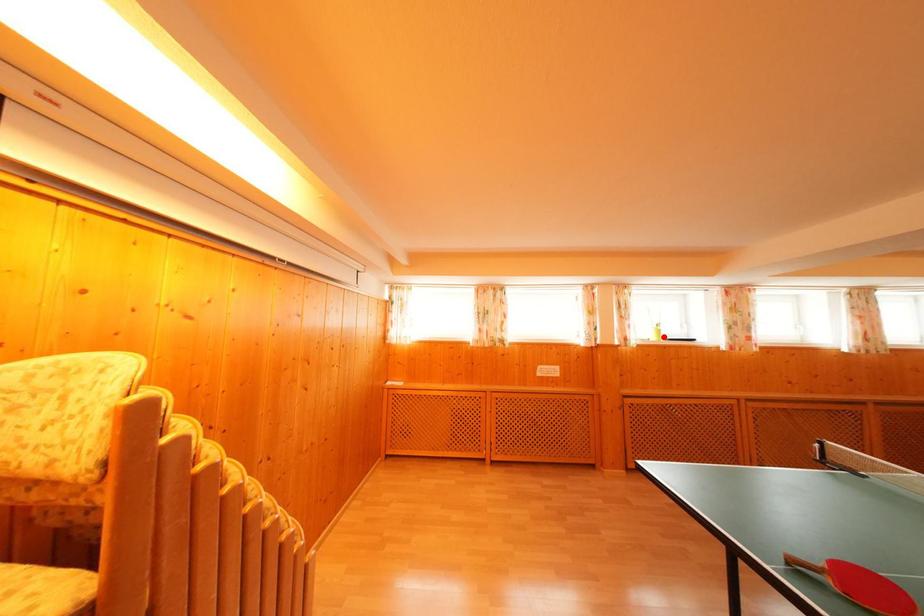
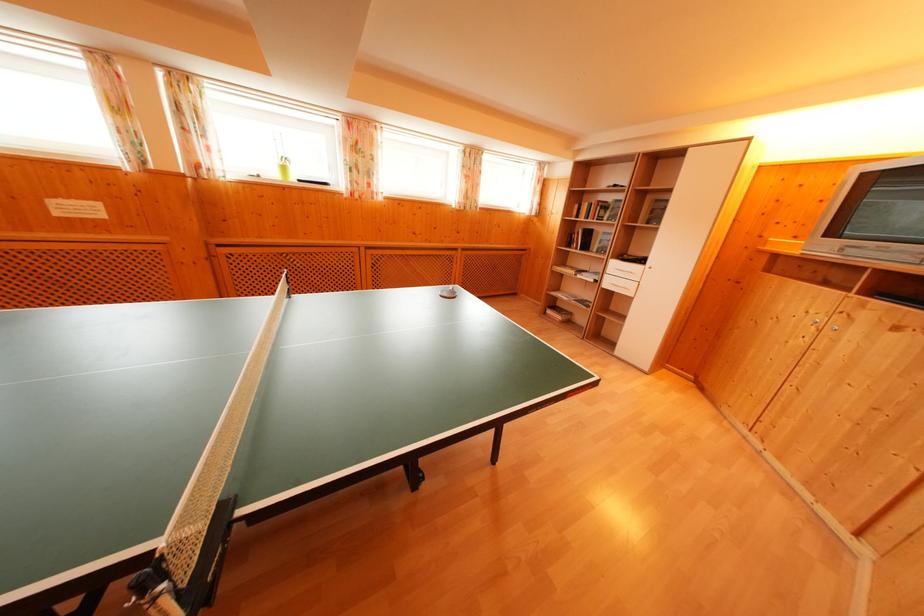
Question: I am providing you with two images of the same scene from different viewpoints. Given a red point in image1, look at the same physical point in image2. Is it:

Choices:
 (A) Closer to the viewpoint
 (B) Farther from the viewpoint

Answer: (A)